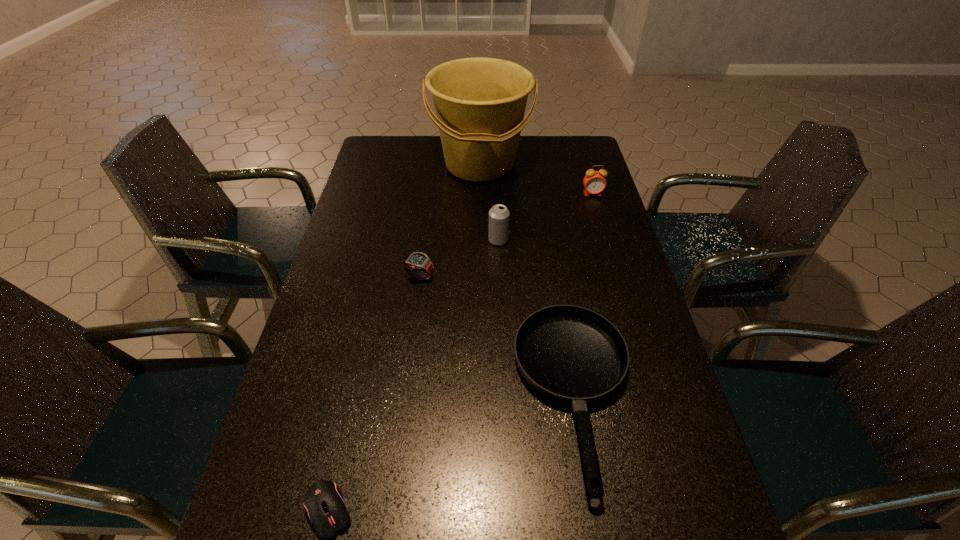
You are a GUI agent. You are given a task and a screenshot of the screen. Output one action in this format:
    pyautogui.click(x=<x>, y=<y>)
    Task: Click on the vacant space located at the end of the handle of the frying pan
    
    Given the screenshot: What is the action you would take?
    pyautogui.click(x=597, y=537)

Locate an element on the screen. object at the far edge is located at coordinates (480, 103).

Find the location of a particular element. Image resolution: width=960 pixels, height=540 pixels. alarm clock located in the right edge section of the desktop is located at coordinates tap(594, 182).

This screenshot has height=540, width=960. Find the location of `frying pan that is at the right edge`. frying pan that is at the right edge is located at coordinates (569, 354).

At what (x,y) coordinates should I click in order to perform the action: click on vacant space at the left edge. Please return your answer as a coordinate pair (x, y). The width and height of the screenshot is (960, 540). Looking at the image, I should click on click(x=361, y=267).

Where is `vacant area at the right edge`? The height and width of the screenshot is (540, 960). vacant area at the right edge is located at coordinates (636, 331).

You are a GUI agent. You are given a task and a screenshot of the screen. Output one action in this format:
    pyautogui.click(x=<x>, y=<y>)
    Task: Click on the free space between the rightmost object and the bucket
    
    Given the screenshot: What is the action you would take?
    pyautogui.click(x=537, y=179)

In order to click on free space between the tallest object and the rightmost object in this screenshot , I will do `click(537, 179)`.

Where is `vacant space that is in between the frying pan and the alarm clock`? vacant space that is in between the frying pan and the alarm clock is located at coordinates (584, 295).

The width and height of the screenshot is (960, 540). Identify the location of unoccupied area between the fourth nearest object and the bucket. (490, 202).